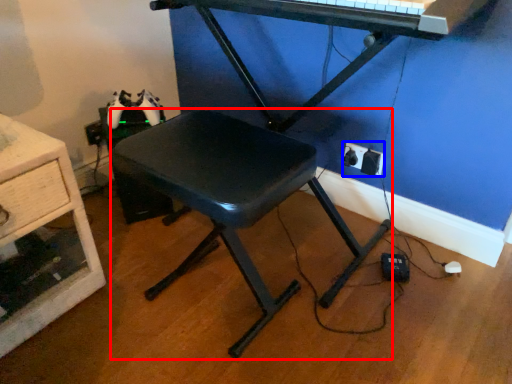
Question: Which object appears closest to the camera in this image, stool (highlighted by a red box) or electric outlet (highlighted by a blue box)?

Choices:
 (A) stool
 (B) electric outlet

Answer: (A)